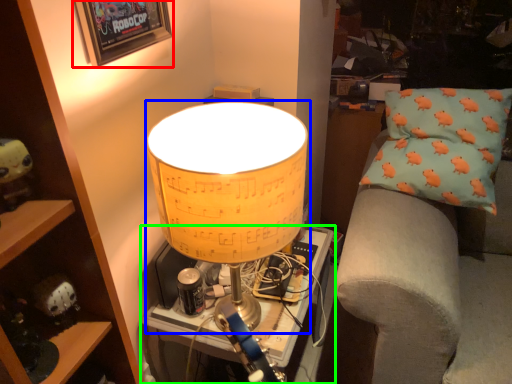
Question: Which object is the farthest from picture frame (highlighted by a red box)? Choose among these: lamp (highlighted by a blue box) or table (highlighted by a green box).

Choices:
 (A) lamp
 (B) table

Answer: (B)